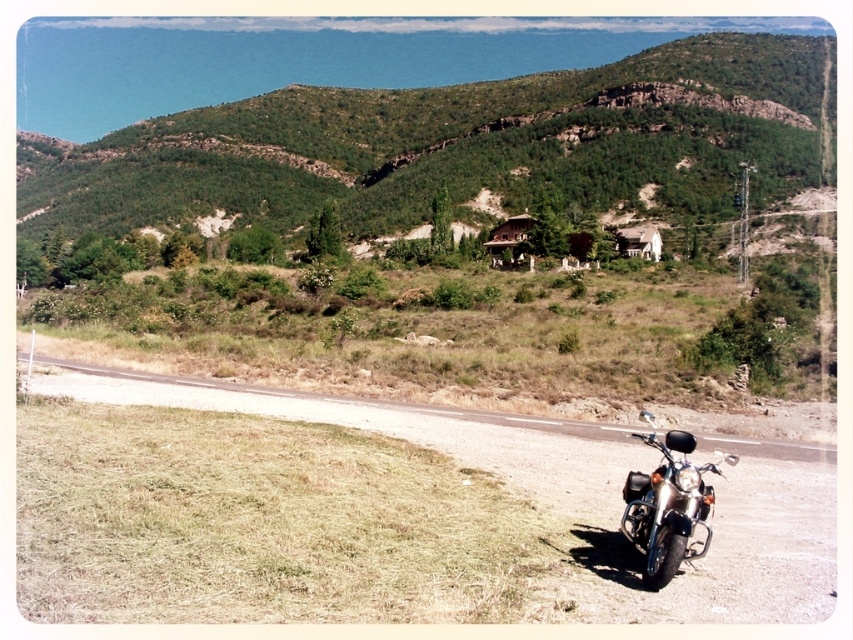
Question: Does gravel road at lower right appear on the left side of white wooden hut at center?

Choices:
 (A) yes
 (B) no

Answer: (A)

Question: Which of the following is the closest to the observer?

Choices:
 (A) (650, 243)
 (B) (341, 422)

Answer: (B)

Question: Which object is farther from the camera taking this photo?

Choices:
 (A) white wooden hut at center
 (B) shiny chrome motorcycle at lower right

Answer: (A)

Question: Based on their relative distances, which object is nearer to the shiny chrome motorcycle at lower right?

Choices:
 (A) gravel road at lower right
 (B) white wooden hut at center

Answer: (A)

Question: Is gravel road at lower right to the right of white wooden hut at center from the viewer's perspective?

Choices:
 (A) no
 (B) yes

Answer: (A)

Question: Observing the image, what is the correct spatial positioning of gravel road at lower right in reference to shiny chrome motorcycle at lower right?

Choices:
 (A) right
 (B) left

Answer: (B)